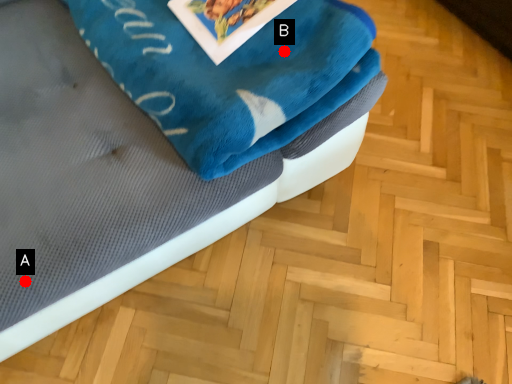
Question: Two points are circled on the image, labeled by A and B beside each circle. Among these points, which one is nearest to the camera?

Choices:
 (A) A is closer
 (B) B is closer

Answer: (A)